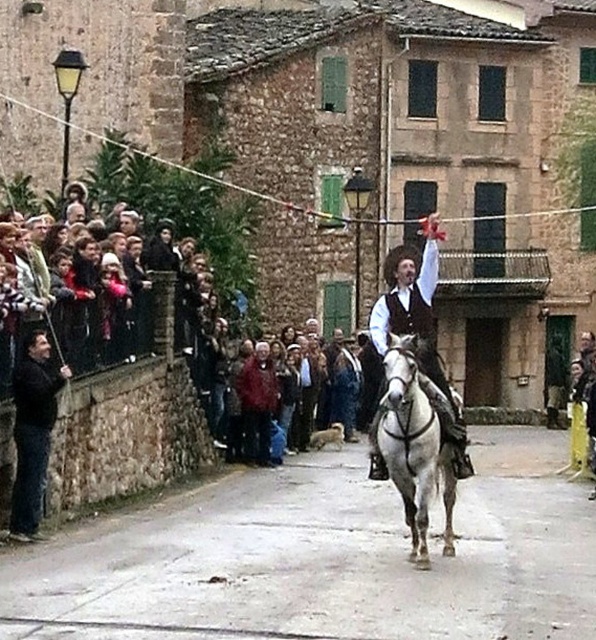
You are a photographer trying to capture the performer in the middle of the scene. The shiny black vest at center and the red wool sweater at center are both in your view. Which one is positioned higher in the frame?

The shiny black vest at center is located above the red wool sweater at center, so it is positioned higher in the frame.